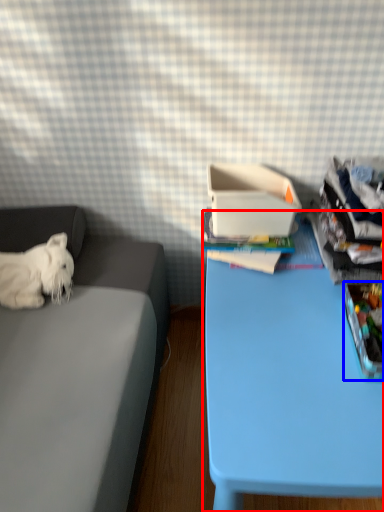
Question: Which of the following is the farthest to the observer, table (highlighted by a red box) or storage box (highlighted by a blue box)?

Choices:
 (A) table
 (B) storage box

Answer: (B)